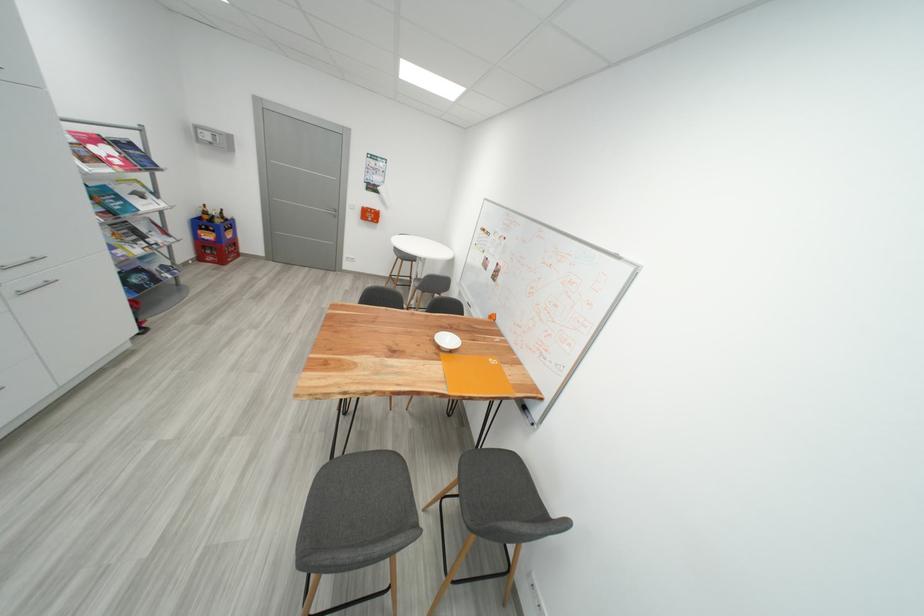
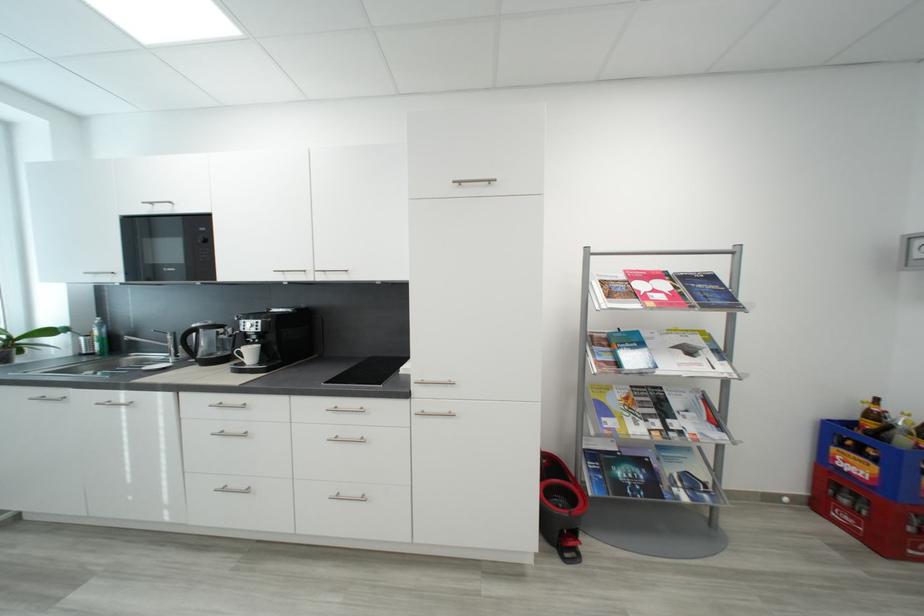
Where in the second image is the point corresponding to pixel 149 198 from the first image?

(697, 353)